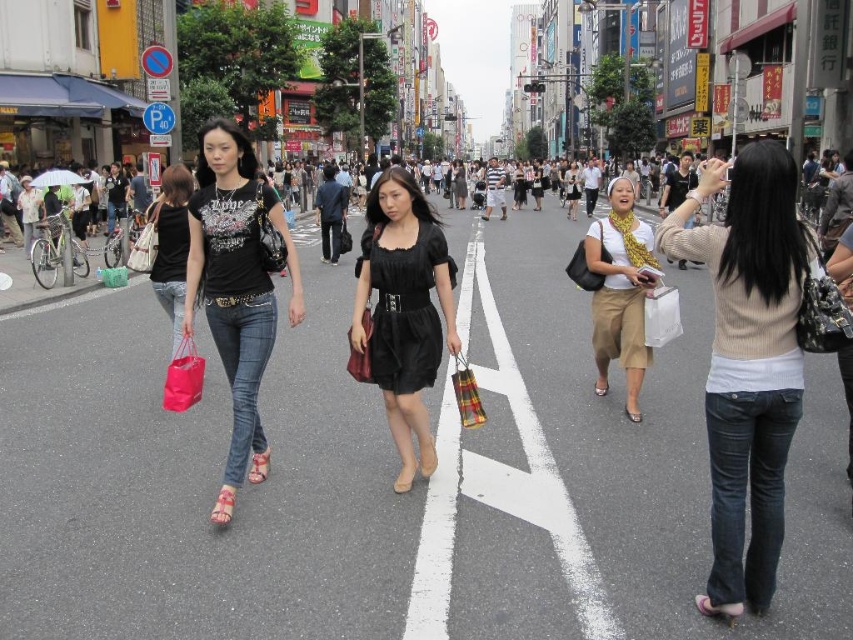
You are a fashion designer observing the group of women crossing the street. You notice the black satin dress at center and the white matte scarf at center. Which clothing item is covering the other?

The black satin dress at center is positioned over the white matte scarf at center, so the dress is covering the scarf.

Looking at the urban street scene, where the matte beige sweater at center and the matte black tank top at left are visible, which clothing item is positioned lower in the image?

The matte beige sweater at center is positioned below the matte black tank top at left, so it is lower in the image.